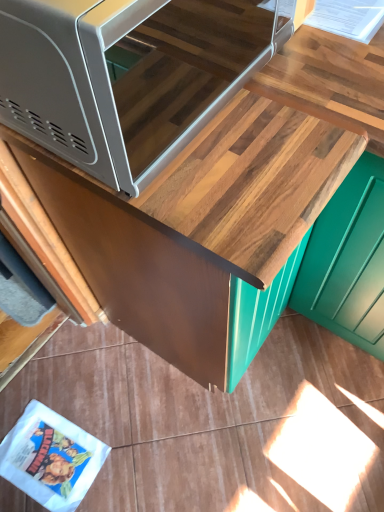
Measure the distance between point (280, 232) and camera.

Point (280, 232) and camera are 21.50 inches apart from each other.

What do you see at coordinates (186, 229) in the screenshot? I see `wooden cabinet at upper center` at bounding box center [186, 229].

Locate an element on the screen. The width and height of the screenshot is (384, 512). wooden cabinet at upper center is located at coordinates (186, 229).

What is the approximate height of wooden cabinet at upper center?

It is 33.12 inches.

This screenshot has width=384, height=512. Describe the element at coordinates (143, 79) in the screenshot. I see `matte gray microwave at upper left` at that location.

I want to click on matte gray microwave at upper left, so click(x=143, y=79).

Locate an element on the screen. wooden cabinet at upper center is located at coordinates [186, 229].

Does matte gray microwave at upper left appear on the right side of wooden cabinet at upper center?

Incorrect, matte gray microwave at upper left is not on the right side of wooden cabinet at upper center.

Between matte gray microwave at upper left and wooden cabinet at upper center, which one is positioned in front?

matte gray microwave at upper left is in front.

Considering the points (95, 124) and (267, 311), which point is behind, point (95, 124) or point (267, 311)?

The point (267, 311) is farther from the camera.

From the image's perspective, between matte gray microwave at upper left and wooden cabinet at upper center, which one is located above?

matte gray microwave at upper left.

From the picture: From a real-world perspective, is matte gray microwave at upper left below wooden cabinet at upper center?

No, from a real-world perspective, matte gray microwave at upper left is not beneath wooden cabinet at upper center.

Can you confirm if matte gray microwave at upper left is wider than wooden cabinet at upper center?

Incorrect, the width of matte gray microwave at upper left does not surpass that of wooden cabinet at upper center.

From their relative heights in the image, would you say matte gray microwave at upper left is taller or shorter than wooden cabinet at upper center?

matte gray microwave at upper left is shorter than wooden cabinet at upper center.

Considering the relative sizes of matte gray microwave at upper left and wooden cabinet at upper center in the image provided, is matte gray microwave at upper left bigger than wooden cabinet at upper center?

No.

Is matte gray microwave at upper left surrounding wooden cabinet at upper center?

Actually, wooden cabinet at upper center is outside matte gray microwave at upper left.

Are matte gray microwave at upper left and wooden cabinet at upper center making contact?

No, matte gray microwave at upper left is not next to wooden cabinet at upper center.

Is matte gray microwave at upper left oriented towards wooden cabinet at upper center?

No, matte gray microwave at upper left is not aimed at wooden cabinet at upper center.

What's the angular difference between matte gray microwave at upper left and wooden cabinet at upper center's facing directions?

The angular difference between matte gray microwave at upper left and wooden cabinet at upper center is 0.329 degrees.

The height and width of the screenshot is (512, 384). I want to click on cabinetry located behind the matte gray microwave at upper left, so pyautogui.click(x=186, y=229).

Considering the relative positions of wooden cabinet at upper center and matte gray microwave at upper left in the image provided, is wooden cabinet at upper center to the left of matte gray microwave at upper left from the viewer's perspective?

No.

Is the depth of wooden cabinet at upper center less than that of matte gray microwave at upper left?

No, the depth of wooden cabinet at upper center is greater than that of matte gray microwave at upper left.

Is point (266, 332) closer or farther from the camera than point (145, 66)?

Point (266, 332) appears to be farther away from the viewer than point (145, 66).

From the image's perspective, which one is positioned higher, wooden cabinet at upper center or matte gray microwave at upper left?

matte gray microwave at upper left, from the image's perspective.

From a real-world perspective, is wooden cabinet at upper center positioned above or below matte gray microwave at upper left?

In terms of real-world spatial position, wooden cabinet at upper center is below matte gray microwave at upper left.

Considering the relative sizes of wooden cabinet at upper center and matte gray microwave at upper left in the image provided, is wooden cabinet at upper center thinner than matte gray microwave at upper left?

No.

Who is shorter, wooden cabinet at upper center or matte gray microwave at upper left?

With less height is matte gray microwave at upper left.

Considering the relative sizes of wooden cabinet at upper center and matte gray microwave at upper left in the image provided, is wooden cabinet at upper center smaller than matte gray microwave at upper left?

No, wooden cabinet at upper center is not smaller than matte gray microwave at upper left.

Do you think wooden cabinet at upper center is within matte gray microwave at upper left, or outside of it?

wooden cabinet at upper center is spatially situated outside matte gray microwave at upper left.

Can you see wooden cabinet at upper center touching matte gray microwave at upper left?

There is a gap between wooden cabinet at upper center and matte gray microwave at upper left.

Could you tell me if wooden cabinet at upper center is turned towards matte gray microwave at upper left?

No, wooden cabinet at upper center does not turn towards matte gray microwave at upper left.

What's the angular difference between wooden cabinet at upper center and matte gray microwave at upper left's facing directions?

0.329 degrees.

Identify the location of cabinetry that is below the matte gray microwave at upper left (from the image's perspective). (186, 229).

Locate an element on the screen. cabinetry on the right of matte gray microwave at upper left is located at coordinates (186, 229).

Find the location of a particular element. The height and width of the screenshot is (512, 384). microwave located on the left of wooden cabinet at upper center is located at coordinates (143, 79).